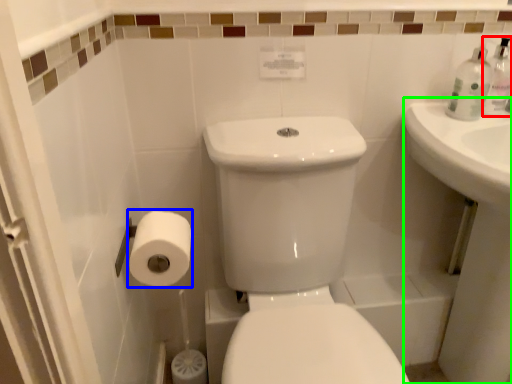
Question: Which object is positioned closest to soap dispenser (highlighted by a red box)? Select from toilet paper (highlighted by a blue box) and counter top (highlighted by a green box).

Choices:
 (A) toilet paper
 (B) counter top

Answer: (B)